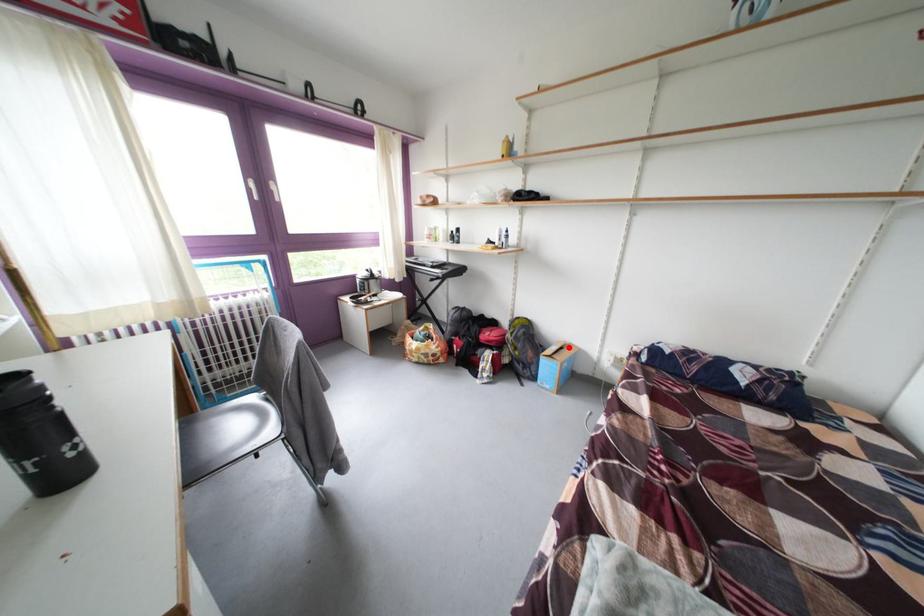
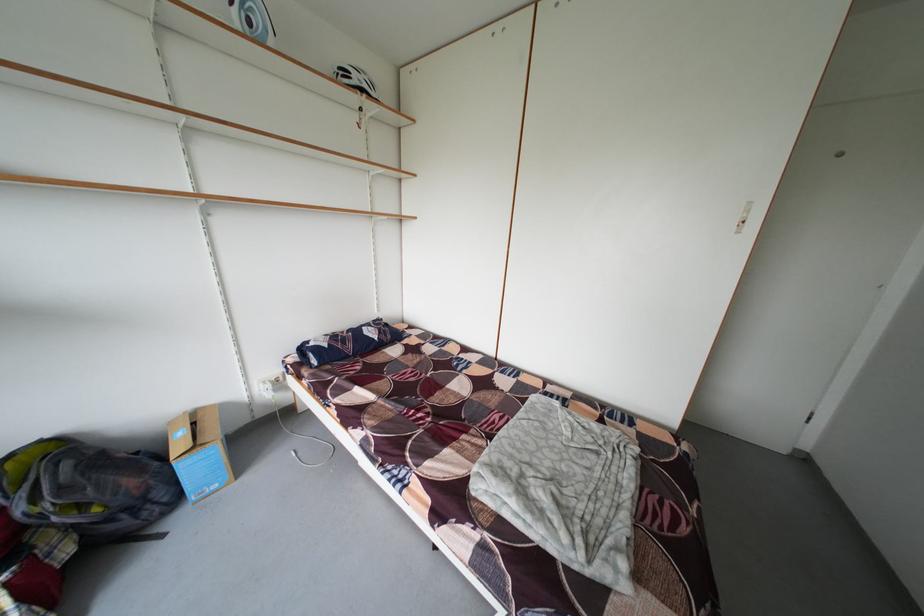
Question: I am providing you with two images of the same scene from different viewpoints. A red point is shown in image1. For the corresponding object point in image2, is it positioned nearer or farther from the camera?

Choices:
 (A) Nearer
 (B) Farther

Answer: (B)